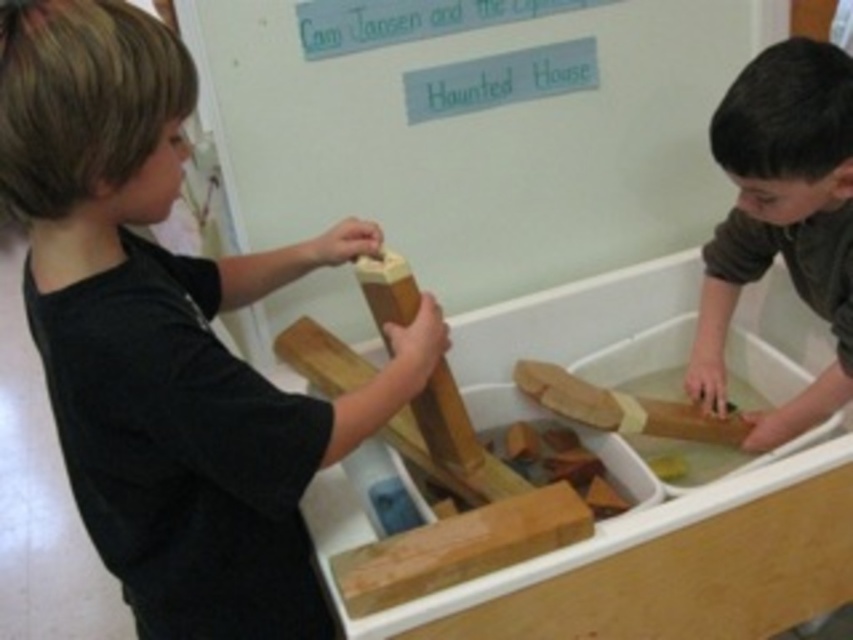
Question: Considering the real-world distances, which object is farthest from the smooth brown wood at right?

Choices:
 (A) wooden sign at upper center
 (B) smooth light brown wood at center
 (C) matte black shirt at left

Answer: (C)

Question: Considering the relative positions of smooth brown wood at right and smooth light brown wood at center in the image provided, where is smooth brown wood at right located with respect to smooth light brown wood at center?

Choices:
 (A) above
 (B) below

Answer: (A)

Question: From the image, what is the correct spatial relationship of wooden sign at upper center in relation to smooth brown wood at right?

Choices:
 (A) below
 (B) above

Answer: (B)

Question: Does matte black shirt at left appear on the left side of smooth brown wood at right?

Choices:
 (A) yes
 (B) no

Answer: (A)

Question: Which point is closer to the camera?

Choices:
 (A) smooth brown wood at right
 (B) matte black shirt at left

Answer: (B)

Question: Which of the following is the closest to the observer?

Choices:
 (A) smooth brown wood at right
 (B) wooden sign at upper center

Answer: (A)